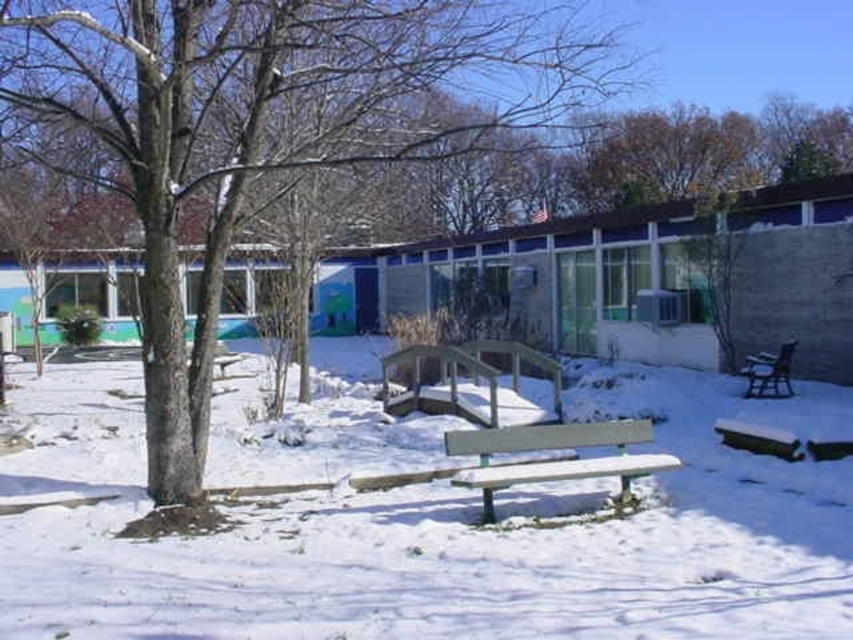
Consider the image. You are a maintenance worker who needs to water the brown rough tree at center using a hose that can reach up to 6 meters. You are currently standing next to the light brown wood bench at center. Can you reach the tree with the hose without moving the hose reel?

The distance between the brown rough tree at center and the light brown wood bench at center is 7.20 meters. Since the hose can only reach up to 6 meters, you cannot reach the tree without moving the hose reel.

You are standing at the wooden bench in the bottom right of the image. Looking towards the center, you see a point marked at coordinates (432, 538). What is located at that point?

The point at (432, 538) marks the location of white matte snow at center, as described in the scene.

You are standing at the point marked as point (432,538) in the winter scene. What is the color and texture of the surface you are standing on?

The surface at point (432,538) is white matte snow.